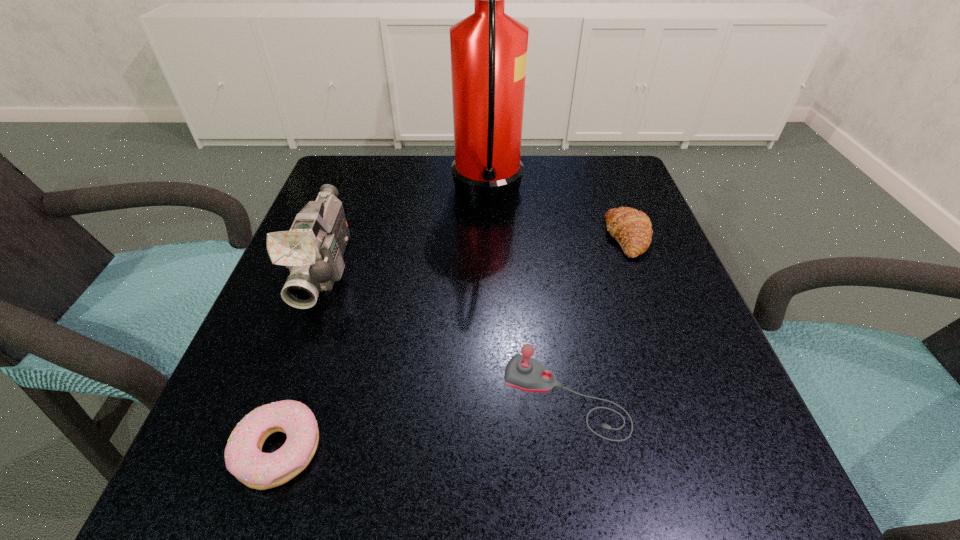
Find the location of a particular element. The image size is (960, 540). vacant space at the far edge of the desktop is located at coordinates (555, 206).

This screenshot has height=540, width=960. What are the coordinates of `vacant space at the near edge` in the screenshot? It's located at (441, 487).

Image resolution: width=960 pixels, height=540 pixels. In order to click on vacant space at the right edge of the desktop in this screenshot , I will do `click(705, 338)`.

Find the location of a particular element. free region at the far left corner of the desktop is located at coordinates pyautogui.click(x=359, y=199).

Locate an element on the screen. The height and width of the screenshot is (540, 960). vacant point at the far right corner is located at coordinates (566, 170).

This screenshot has height=540, width=960. I want to click on free space at the near right corner of the desktop, so click(x=696, y=463).

Locate an element on the screen. The image size is (960, 540). vacant space that is in between the fire extinguisher and the rightmost object is located at coordinates (558, 218).

At what (x,y) coordinates should I click in order to perform the action: click on unoccupied area between the doughnut and the tallest object. Please return your answer as a coordinate pair (x, y). The image size is (960, 540). Looking at the image, I should click on (383, 323).

You are a GUI agent. You are given a task and a screenshot of the screen. Output one action in this format:
    pyautogui.click(x=<x>, y=<y>)
    Task: Click on the free space between the tallest object and the third tallest object
    
    Given the screenshot: What is the action you would take?
    pyautogui.click(x=526, y=298)

Image resolution: width=960 pixels, height=540 pixels. I want to click on unoccupied area between the camcorder and the rightmost object, so pos(477,253).